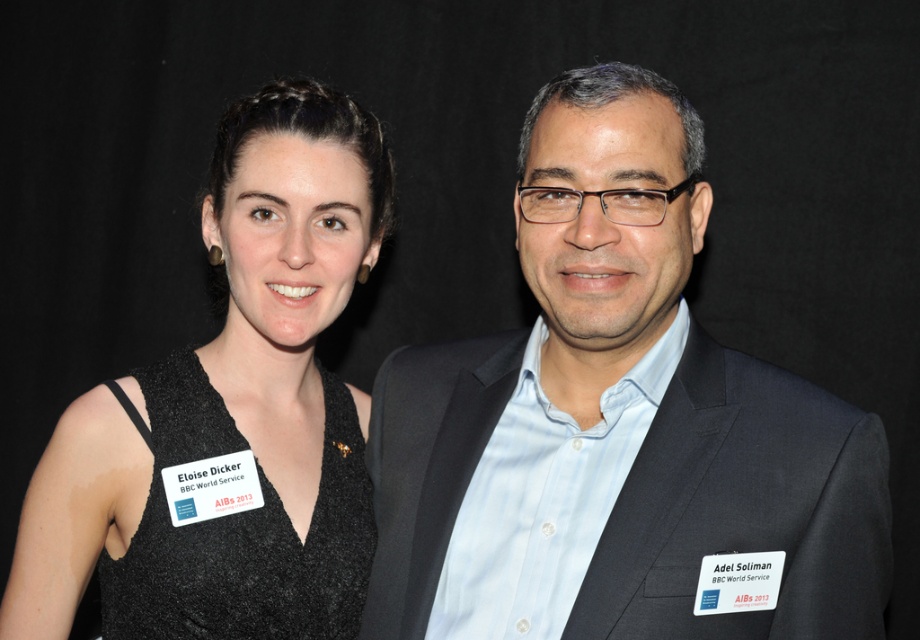
Question: Is matte black suit at center further to camera compared to black textured dress at left?

Choices:
 (A) no
 (B) yes

Answer: (A)

Question: Which object appears farthest from the camera in this image?

Choices:
 (A) black textured dress at left
 (B) matte black suit at center

Answer: (A)

Question: Considering the relative positions of matte black suit at center and black textured dress at left in the image provided, where is matte black suit at center located with respect to black textured dress at left?

Choices:
 (A) left
 (B) right

Answer: (B)

Question: Which object appears closest to the camera in this image?

Choices:
 (A) matte black suit at center
 (B) black textured dress at left

Answer: (A)

Question: Can you confirm if matte black suit at center is positioned to the left of black textured dress at left?

Choices:
 (A) no
 (B) yes

Answer: (A)